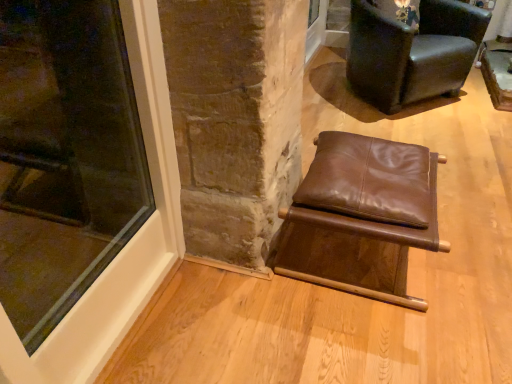
Identify the location of vacant space underneath transparent glass window at lower left (from a real-world perspective). (129, 324).